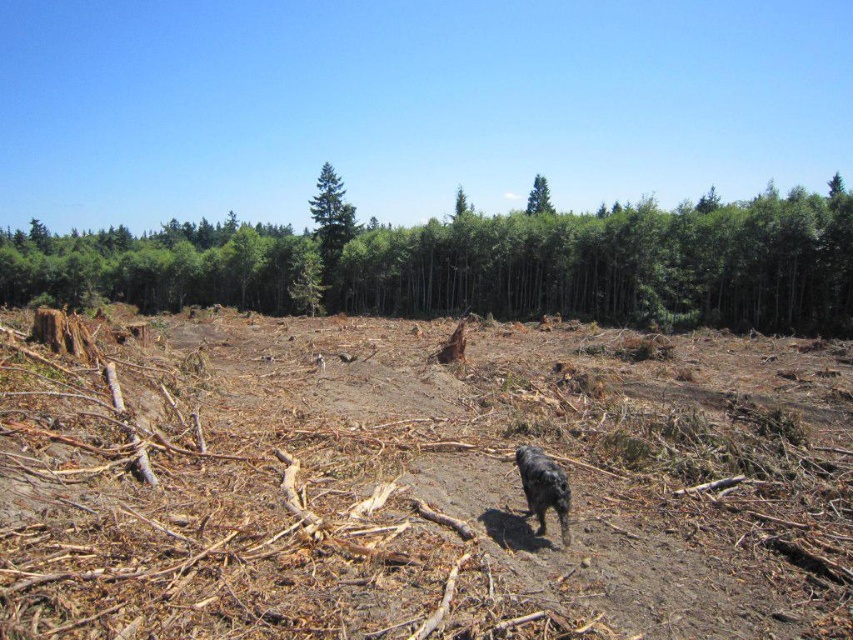
Consider the image. You are navigating a drone over a forest clearing and need to avoid the black furry dog at center. What are the coordinates to direct the drone away from the dog?

The black furry dog at center is located at point [543,486]. To avoid it, direct the drone to coordinates that are not overlapping with these values, such as moving north or east to areas with higher or lower coordinate values respectively.

You are a hiker who wants to take a shortcut through the forest clearing. You see the green textured tree at center and the brown rough tree stump at center. Which object is closer to you as you approach the clearing?

The green textured tree at center is closer to you because the brown rough tree stump at center is positioned behind it.